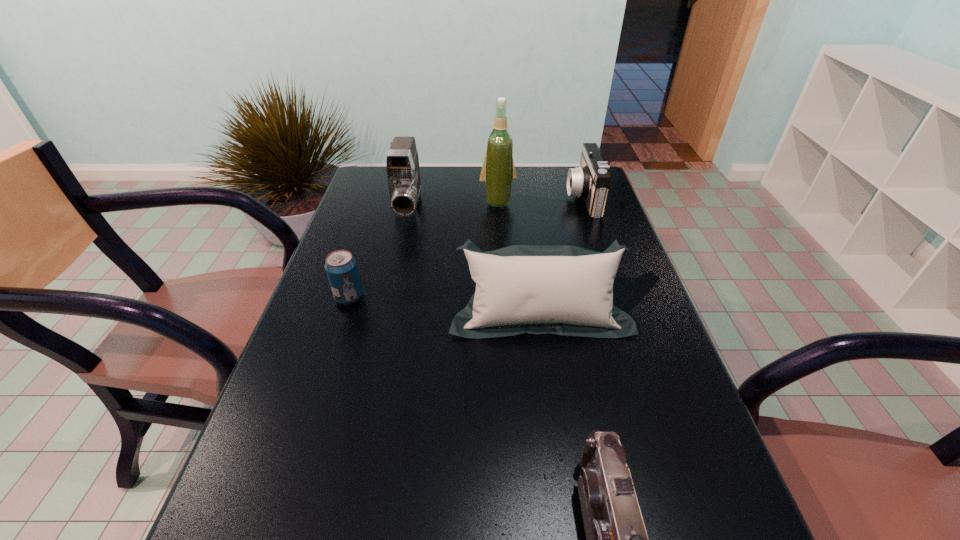
Identify the location of vacant space situated on the lens of the rightmost camcorder. This screenshot has height=540, width=960. (470, 198).

Image resolution: width=960 pixels, height=540 pixels. Find the location of `free location located 0.290m on the lens of the rightmost camcorder`. free location located 0.290m on the lens of the rightmost camcorder is located at coordinates (476, 198).

Find the location of `free space located 0.340m on the right of the leftmost object`. free space located 0.340m on the right of the leftmost object is located at coordinates (505, 297).

This screenshot has width=960, height=540. Find the location of `wine bottle that is at the far edge`. wine bottle that is at the far edge is located at coordinates (498, 171).

What are the coordinates of `camcorder that is at the left edge` in the screenshot? It's located at (402, 165).

Locate an element on the screen. pop soda positioned at the left edge is located at coordinates (341, 268).

Find the location of `cushion that is at the right edge`. cushion that is at the right edge is located at coordinates (566, 290).

I want to click on camcorder present at the right edge, so click(x=591, y=180).

You are a GUI agent. You are given a task and a screenshot of the screen. Output one action in this format:
    pyautogui.click(x=<x>, y=<y>)
    Task: Click on the object present at the far left corner
    The image size is (960, 540).
    Given the screenshot: What is the action you would take?
    pyautogui.click(x=402, y=165)

This screenshot has width=960, height=540. I want to click on object located at the far right corner, so click(591, 180).